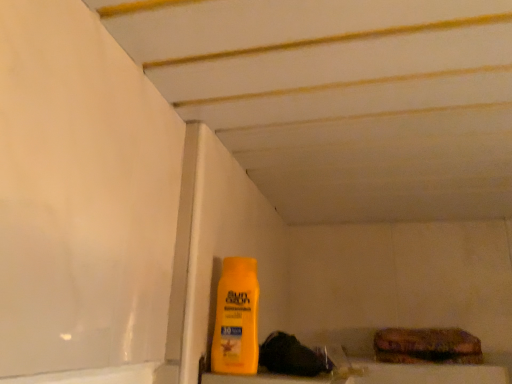
Question: Does point (253, 344) appear closer or farther from the camera than point (394, 336)?

Choices:
 (A) farther
 (B) closer

Answer: (B)

Question: From their relative heights in the image, would you say yellow matte bottle at center is taller or shorter than textured brown bread at lower right?

Choices:
 (A) short
 (B) tall

Answer: (B)

Question: From a real-world perspective, relative to textured brown bread at lower right, is yellow matte bottle at center vertically above or below?

Choices:
 (A) above
 (B) below

Answer: (A)

Question: From the image's perspective, is textured brown bread at lower right above or below yellow matte bottle at center?

Choices:
 (A) below
 (B) above

Answer: (A)

Question: Is textured brown bread at lower right bigger or smaller than yellow matte bottle at center?

Choices:
 (A) big
 (B) small

Answer: (A)

Question: Considering their positions, is textured brown bread at lower right located in front of or behind yellow matte bottle at center?

Choices:
 (A) behind
 (B) front

Answer: (A)

Question: Looking at their shapes, would you say textured brown bread at lower right is wider or thinner than yellow matte bottle at center?

Choices:
 (A) wide
 (B) thin

Answer: (A)